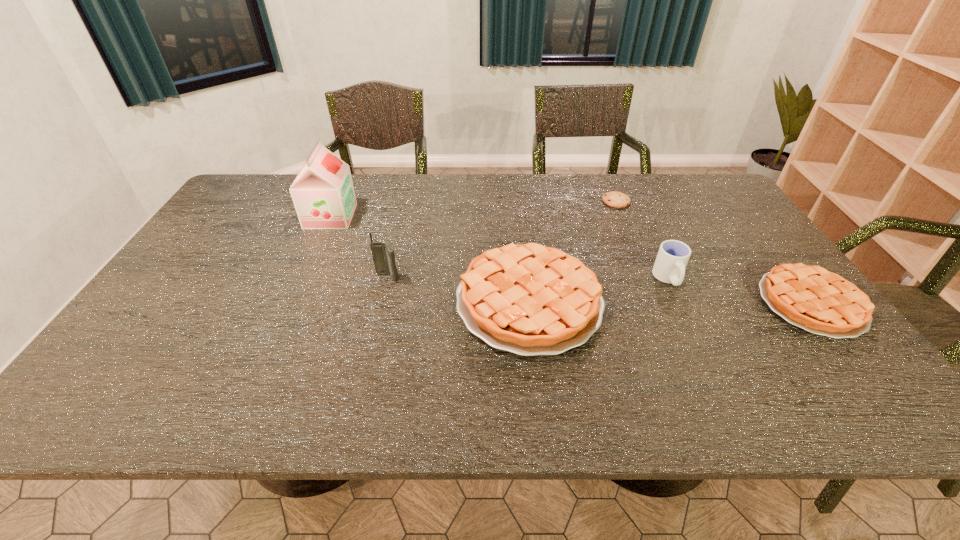
Where is `free location at the far edge`? free location at the far edge is located at coordinates [535, 195].

The width and height of the screenshot is (960, 540). I want to click on vacant space at the near edge of the desktop, so click(x=717, y=360).

The height and width of the screenshot is (540, 960). Identify the location of vacant area at the left edge. (192, 335).

In the image, there is a desktop. Identify the location of blank space at the right edge. The image size is (960, 540). (802, 339).

Find the location of a particular element. This screenshot has height=540, width=960. free spot at the near left corner of the desktop is located at coordinates (109, 355).

This screenshot has width=960, height=540. I want to click on free region at the far right corner of the desktop, so click(x=725, y=197).

Identify the location of free spot between the cookie and the fourth shortest object. (642, 240).

Locate an element on the screen. The height and width of the screenshot is (540, 960). free area in between the cup and the shortest object is located at coordinates (642, 240).

Image resolution: width=960 pixels, height=540 pixels. In order to click on free space between the third object from left to right and the cookie in this screenshot , I will do `click(572, 251)`.

The width and height of the screenshot is (960, 540). I want to click on vacant space that is in between the third tallest object and the soya milk, so click(499, 247).